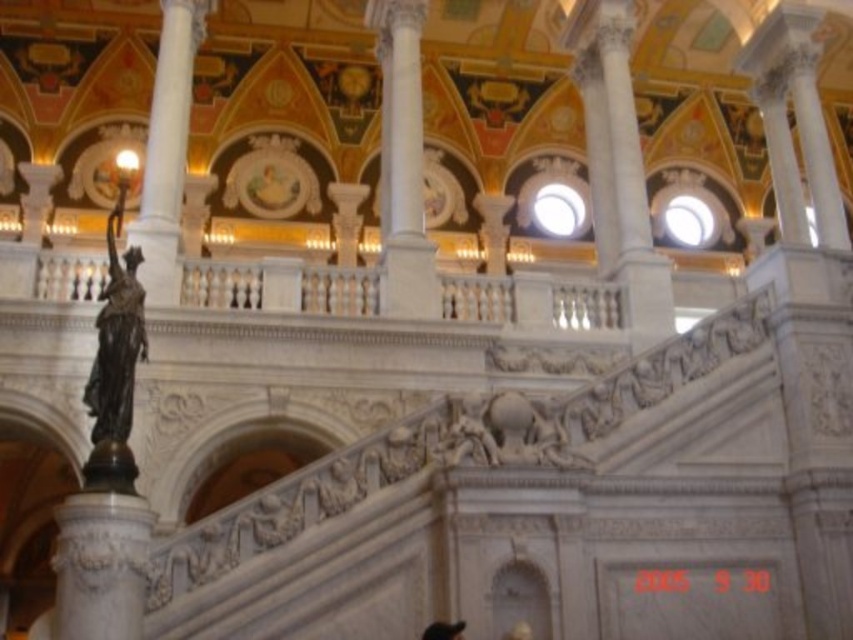
In the scene shown: Is white marble column at upper center taller than bronze statue at left?

Correct, white marble column at upper center is much taller as bronze statue at left.

Does point (198, 6) lie in front of point (109, 246)?

No, it is not.

Is point (178, 67) less distant than point (141, 324)?

No, (178, 67) is behind (141, 324).

Locate an element on the screen. white marble column at upper center is located at coordinates (167, 150).

In the scene shown: Who is higher up, white marble column at center or black hair at lower center?

white marble column at center is above.

Is point (405, 212) positioned before point (440, 630)?

No, it is behind (440, 630).

The image size is (853, 640). I want to click on white marble column at center, so click(402, 163).

Does white marble column at center appear on the left side of white marble column at upper center?

In fact, white marble column at center is to the right of white marble column at upper center.

Does white marble column at center appear under white marble column at upper center?

Incorrect, white marble column at center is not positioned below white marble column at upper center.

Which is in front, point (378, 12) or point (148, 154)?

Point (148, 154) is in front.

The image size is (853, 640). What are the coordinates of `white marble column at center` in the screenshot? It's located at (402, 163).